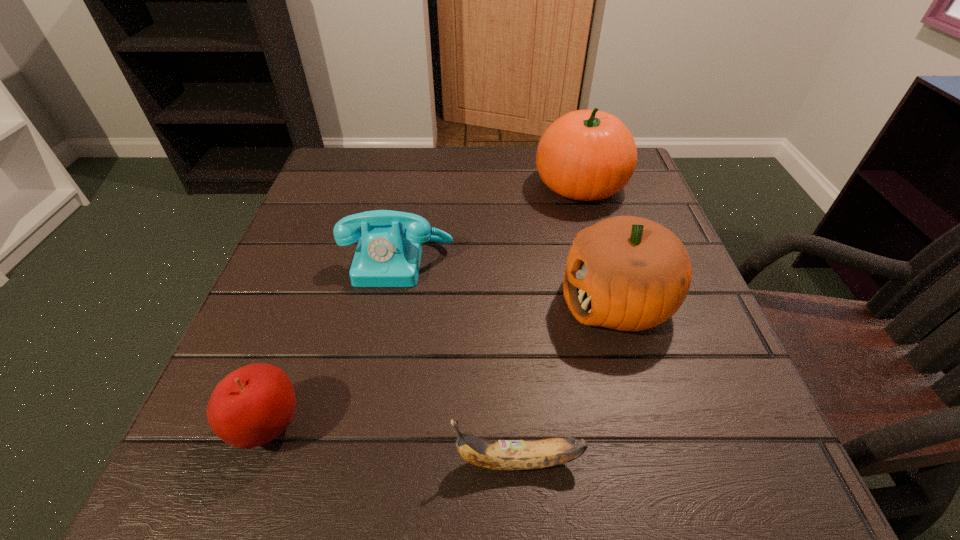
Find the location of a particular element. The image size is (960, 540). free area in between the telephone and the banana is located at coordinates (458, 361).

I want to click on empty space between the nearer pumpkin and the telephone, so tap(508, 281).

This screenshot has height=540, width=960. I want to click on free space between the telephone and the shortest object, so click(x=458, y=361).

Where is `vacant space that is in between the nearer pumpkin and the shortest object`? The height and width of the screenshot is (540, 960). vacant space that is in between the nearer pumpkin and the shortest object is located at coordinates (567, 381).

Find the location of `free space between the nearer pumpkin and the telephone`. free space between the nearer pumpkin and the telephone is located at coordinates (508, 281).

Locate an element on the screen. object that stands as the fourth closest to the apple is located at coordinates (586, 155).

Identify which object is located as the nearest to the nearer pumpkin. Please provide its 2D coordinates. Your answer should be formatted as a tuple, i.e. [(x, y)], where the tuple contains the x and y coordinates of a point satisfying the conditions above.

[(586, 155)]